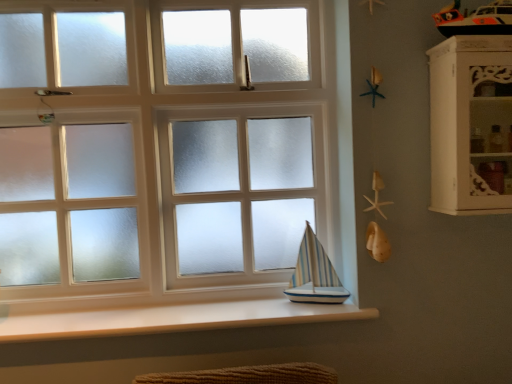
Where is `white frosted glass at center`? white frosted glass at center is located at coordinates (165, 162).

What do you see at coordinates (315, 274) in the screenshot?
I see `blue striped wood sailboat at lower center` at bounding box center [315, 274].

Where is `white wood cabinet at right`? white wood cabinet at right is located at coordinates (469, 123).

You are a GUI agent. You are given a task and a screenshot of the screen. Output one action in this format:
    pyautogui.click(x=<x>, y=<y>)
    Task: Click on the white smooth wood at lower center
    The width and height of the screenshot is (512, 384).
    Given the screenshot: What is the action you would take?
    point(175,319)

You are a GUI agent. You are given a task and a screenshot of the screen. Output one action in this format:
    pyautogui.click(x=<x>, y=<y>)
    Task: Click on the white frosted glass at center
    The height and width of the screenshot is (384, 512).
    Given the screenshot: What is the action you would take?
    pyautogui.click(x=165, y=162)

Can you tell me how much blue striped wood sailboat at lower center and white smooth wood at lower center differ in facing direction?

The angle between the facing direction of blue striped wood sailboat at lower center and the facing direction of white smooth wood at lower center is 0.000783 degrees.

Is blue striped wood sailboat at lower center taller than white smooth wood at lower center?

Yes.

Is point (309, 237) positioned before point (52, 317)?

That is False.

Based on the photo, is blue striped wood sailboat at lower center next to white smooth wood at lower center and touching it?

blue striped wood sailboat at lower center is not next to white smooth wood at lower center, and they're not touching.

At what (x,y) coordinates should I click in order to perform the action: click on shelf lying on the right of blue striped wood sailboat at lower center. Please return your answer as a coordinate pair (x, y). The image size is (512, 384). Looking at the image, I should click on (469, 123).

Considering the sizes of objects white wood cabinet at right and blue striped wood sailboat at lower center in the image provided, who is wider, white wood cabinet at right or blue striped wood sailboat at lower center?

Wider between the two is white wood cabinet at right.

Is point (471, 134) closer to viewer compared to point (334, 287)?

Yes, point (471, 134) is in front of point (334, 287).

Are blue striped wood sailboat at lower center and white wood cabinet at right beside each other?

They are not placed beside each other.

Is white wood cabinet at right completely or partially inside blue striped wood sailboat at lower center?

No, white wood cabinet at right is located outside of blue striped wood sailboat at lower center.

Consider the image. Is blue striped wood sailboat at lower center taller or shorter than white wood cabinet at right?

In the image, blue striped wood sailboat at lower center appears to be shorter than white wood cabinet at right.

Between blue striped wood sailboat at lower center and white wood cabinet at right, which one has smaller size?

blue striped wood sailboat at lower center.

Is white wood cabinet at right thinner than white frosted glass at center?

Incorrect, the width of white wood cabinet at right is not less than that of white frosted glass at center.

What's the angular difference between white wood cabinet at right and white frosted glass at center's facing directions?

The facing directions of white wood cabinet at right and white frosted glass at center are 0.598 degrees apart.

Does point (456, 57) lie in front of point (252, 233)?

Yes, point (456, 57) is in front of point (252, 233).

From their relative heights in the image, would you say white wood cabinet at right is taller or shorter than white frosted glass at center?

Clearly, white wood cabinet at right is shorter compared to white frosted glass at center.

Between white frosted glass at center and white smooth wood at lower center, which one has smaller size?

Smaller between the two is white smooth wood at lower center.

Is white frosted glass at center in front of or behind white smooth wood at lower center in the image?

Clearly, white frosted glass at center is behind white smooth wood at lower center.

Looking at this image, how many degrees apart are the facing directions of white frosted glass at center and white smooth wood at lower center?

The angle between the facing direction of white frosted glass at center and the facing direction of white smooth wood at lower center is 0.598 degrees.

In the image, there is a white smooth wood at lower center. At what (x,y) coordinates should I click in order to perform the action: click on window above it (from the image's perspective). Please return your answer as a coordinate pair (x, y). Image resolution: width=512 pixels, height=384 pixels. Looking at the image, I should click on (165, 162).

Between white frosted glass at center and white wood cabinet at right, which one has larger size?

Bigger between the two is white frosted glass at center.

From the image's perspective, is white frosted glass at center above white wood cabinet at right?

Actually, white frosted glass at center appears below white wood cabinet at right in the image.

Considering the sizes of white frosted glass at center and white wood cabinet at right in the image, is white frosted glass at center wider or thinner than white wood cabinet at right?

white frosted glass at center is thinner than white wood cabinet at right.

Considering the sizes of objects white smooth wood at lower center and white frosted glass at center in the image provided, who is shorter, white smooth wood at lower center or white frosted glass at center?

white smooth wood at lower center.

I want to click on window sill in front of the white frosted glass at center, so click(x=175, y=319).

Would you say white smooth wood at lower center is a long distance from white frosted glass at center?

That's not correct — white smooth wood at lower center is a little close to white frosted glass at center.

I want to click on window sill that appears below the blue striped wood sailboat at lower center (from the image's perspective), so point(175,319).

Locate an element on the screen. The height and width of the screenshot is (384, 512). sailboat below the white wood cabinet at right (from a real-world perspective) is located at coordinates tap(315, 274).

Based on their spatial positions, is white wood cabinet at right or blue striped wood sailboat at lower center further from white smooth wood at lower center?

The object further to white smooth wood at lower center is white wood cabinet at right.

When comparing their distances from white wood cabinet at right, does white frosted glass at center or blue striped wood sailboat at lower center seem further?

white frosted glass at center is further to white wood cabinet at right.

Based on their spatial positions, is white smooth wood at lower center or white frosted glass at center closer to blue striped wood sailboat at lower center?

Based on the image, white smooth wood at lower center appears to be nearer to blue striped wood sailboat at lower center.

Based on their spatial positions, is white smooth wood at lower center or blue striped wood sailboat at lower center further from white frosted glass at center?

blue striped wood sailboat at lower center lies further to white frosted glass at center than the other object.

Based on their spatial positions, is white smooth wood at lower center or blue striped wood sailboat at lower center further from white wood cabinet at right?

white smooth wood at lower center is positioned further to the anchor white wood cabinet at right.

Which object lies further to the anchor point white smooth wood at lower center, white frosted glass at center or white wood cabinet at right?

white wood cabinet at right is positioned further to the anchor white smooth wood at lower center.

Estimate the real-world distances between objects in this image. Which object is further from blue striped wood sailboat at lower center, white smooth wood at lower center or white wood cabinet at right?

The object further to blue striped wood sailboat at lower center is white wood cabinet at right.

In the scene shown: From the image, which object appears to be nearer to blue striped wood sailboat at lower center, white frosted glass at center or white wood cabinet at right?

white frosted glass at center lies closer to blue striped wood sailboat at lower center than the other object.

Identify the location of sailboat between white smooth wood at lower center and white wood cabinet at right. This screenshot has height=384, width=512. (315, 274).

The image size is (512, 384). Find the location of `window sill situated between white frosted glass at center and white wood cabinet at right from left to right`. window sill situated between white frosted glass at center and white wood cabinet at right from left to right is located at coordinates [175, 319].

The height and width of the screenshot is (384, 512). In order to click on sailboat between white frosted glass at center and white smooth wood at lower center vertically in this screenshot , I will do `click(315, 274)`.

Identify the location of sailboat between white frosted glass at center and white wood cabinet at right in the horizontal direction. The image size is (512, 384). (315, 274).